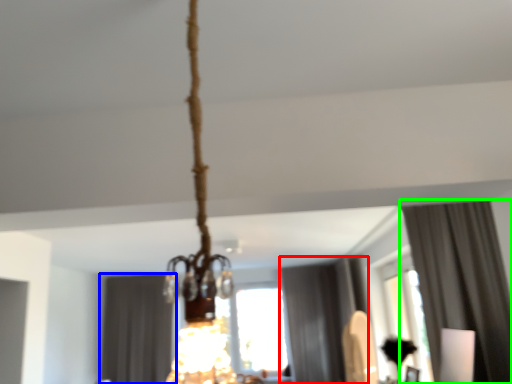
Question: Which object is the closest to the curtain (highlighted by a red box)? Choose among these: curtain (highlighted by a blue box) or curtain (highlighted by a green box).

Choices:
 (A) curtain
 (B) curtain

Answer: (A)